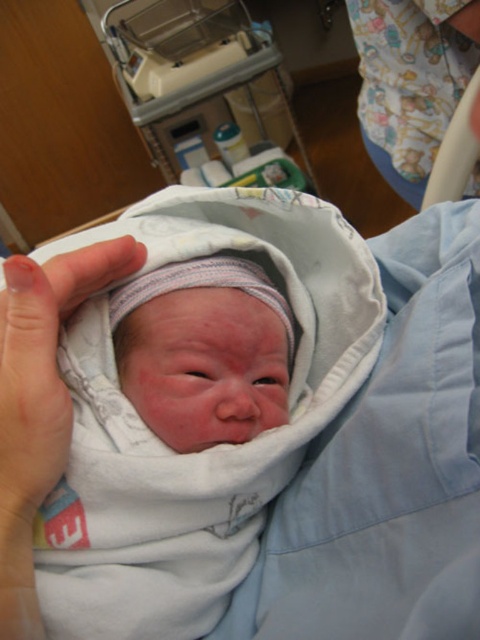
Can you confirm if smooth white swaddle at center is positioned to the right of pink flesh at center?

Correct, you'll find smooth white swaddle at center to the right of pink flesh at center.

Is point (152, 412) closer to camera compared to point (33, 484)?

No, (152, 412) is behind (33, 484).

Does point (239, 307) come farther from viewer compared to point (41, 424)?

Yes.

Where is `smooth white swaddle at center`? smooth white swaddle at center is located at coordinates (204, 352).